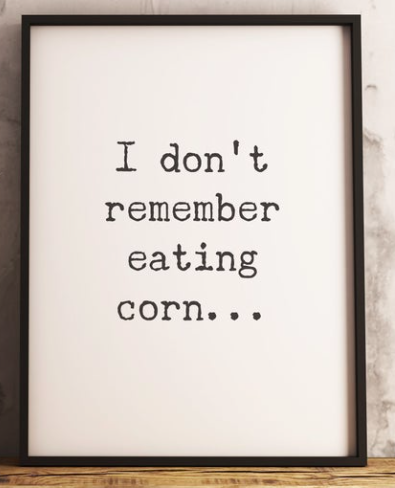
Locate an element on the screen. Image resolution: width=395 pixels, height=488 pixels. wallpaper is located at coordinates (372, 230).